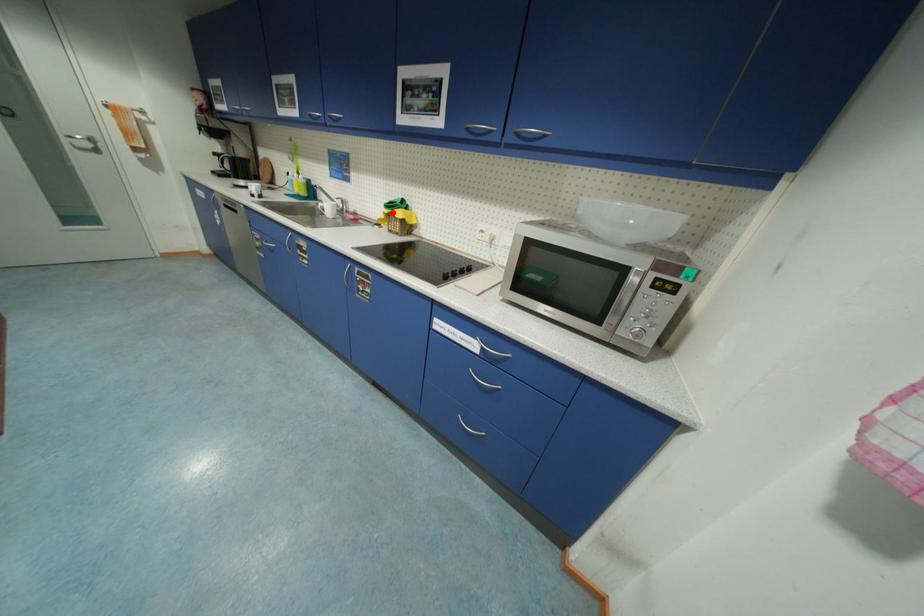
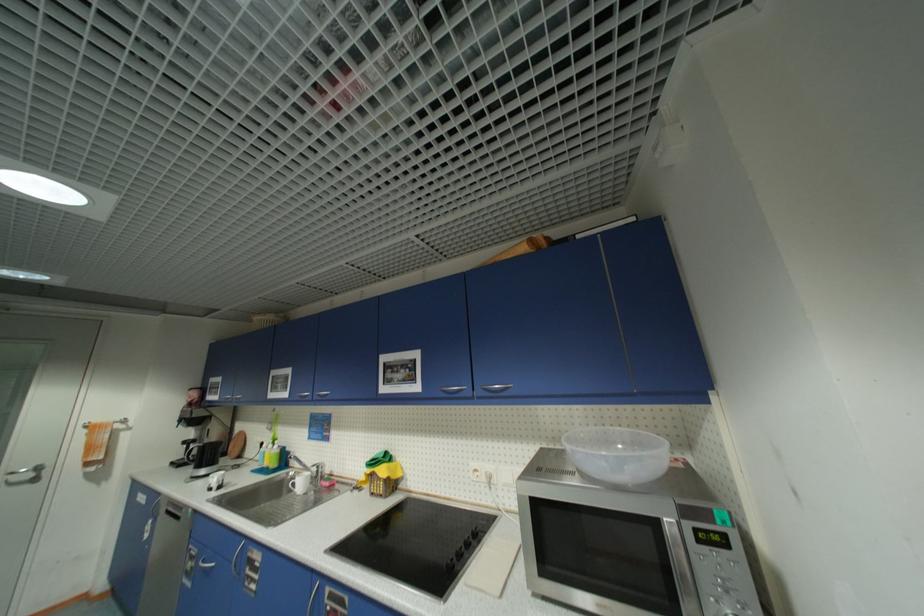
Question: I am providing you with two images of the same scene from different viewpoints. Image1 has a red point marked. In image2, the corresponding 3D location appears at what relative position? Reply with the corresponding letter.

Choices:
 (A) Closer
 (B) Farther

Answer: (B)